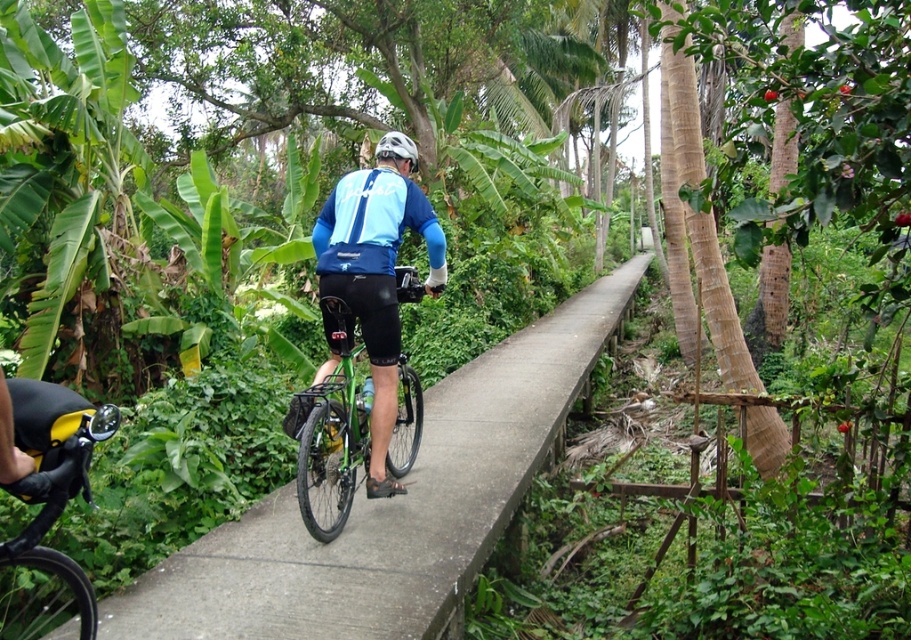
You are a drone operator trying to capture aerial footage of the cyclist. You have two points marked on your map, point A at coordinates point (54, 620) and point B at coordinates point (406, 401). Which point is closer to the cyclist?

Point (54, 620) is in front of point (406, 401), so it is closer to the cyclist.

You are a cyclist trying to navigate a narrow path surrounded by tropical plants. You see a yellow matte bicycle handlebar at lower left and a green matte bicycle at center. Which object is closer to you as you look forward along the path?

The yellow matte bicycle handlebar at lower left is closer to you because it is positioned in front of the green matte bicycle at center along the path.